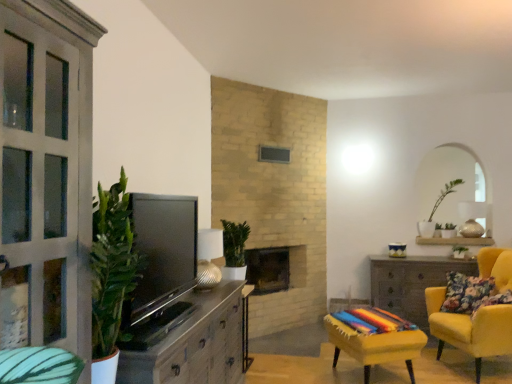
Question: Is green matte plant at center, the second houseplant in the back-to-front sequence, outside brick fireplace at center?

Choices:
 (A) no
 (B) yes

Answer: (B)

Question: From the image's perspective, is green matte plant at center, the first houseplant from the left, beneath brick fireplace at center?

Choices:
 (A) no
 (B) yes

Answer: (A)

Question: Is green matte plant at center, the second houseplant from the right, smaller than brick fireplace at center?

Choices:
 (A) yes
 (B) no

Answer: (A)

Question: Can you confirm if green matte plant at center, the first houseplant from the left, is positioned to the left of brick fireplace at center?

Choices:
 (A) yes
 (B) no

Answer: (A)

Question: Is green matte plant at center, arranged as the 1th houseplant when viewed from the front, next to brick fireplace at center?

Choices:
 (A) no
 (B) yes

Answer: (A)

Question: In terms of width, does yellow fabric-covered chair at lower right, acting as the 2th chair starting from the right, look wider or thinner when compared to green matte plant at upper right, which is the 2th houseplant in left-to-right order?

Choices:
 (A) wide
 (B) thin

Answer: (A)

Question: From the image's perspective, relative to green matte plant at upper right, which is the 2th houseplant in left-to-right order, is yellow fabric-covered chair at lower right, which is the 1th chair from left to right, above or below?

Choices:
 (A) below
 (B) above

Answer: (A)

Question: Visually, is yellow fabric-covered chair at lower right, which is the 1th chair from left to right, positioned to the left or to the right of green matte plant at upper right, which is the 2th houseplant in left-to-right order?

Choices:
 (A) right
 (B) left

Answer: (B)

Question: Considering the positions of yellow fabric-covered chair at lower right, acting as the 2th chair starting from the right, and green matte plant at upper right, placed as the 2th houseplant when sorted from front to back, in the image, is yellow fabric-covered chair at lower right, acting as the 2th chair starting from the right, taller or shorter than green matte plant at upper right, placed as the 2th houseplant when sorted from front to back,?

Choices:
 (A) tall
 (B) short

Answer: (B)

Question: Is point (202, 238) closer or farther from the camera than point (458, 246)?

Choices:
 (A) closer
 (B) farther

Answer: (A)

Question: Based on their positions, is metallic ribbed lampshade at center located to the left or right of green leafy plant at center-right?

Choices:
 (A) right
 (B) left

Answer: (B)

Question: From the image's perspective, is metallic ribbed lampshade at center positioned above or below green leafy plant at center-right?

Choices:
 (A) above
 (B) below

Answer: (A)

Question: Relative to green leafy plant at center-right, is metallic ribbed lampshade at center in front or behind?

Choices:
 (A) behind
 (B) front

Answer: (B)

Question: From the image's perspective, is wooden cabinet at left above or below floral fabric pillow at right?

Choices:
 (A) below
 (B) above

Answer: (A)

Question: Is point (179, 355) positioned closer to the camera than point (470, 299)?

Choices:
 (A) closer
 (B) farther

Answer: (A)